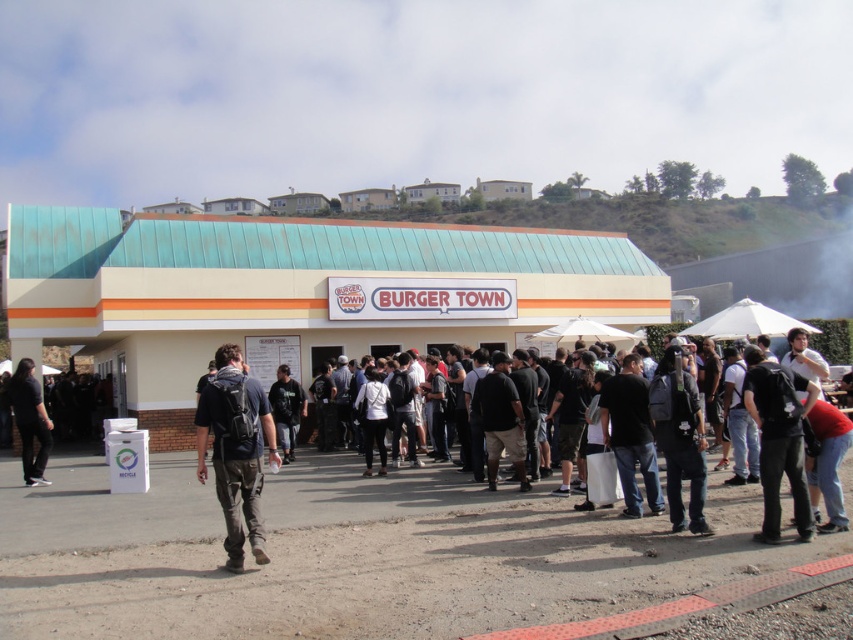
You are standing at the entrance of Burger Town and notice two people wearing dark blue jeans at center and dark gray fabric shirt at center. Which clothing item is located to the right when facing the entrance?

The dark blue jeans at center is positioned on the right side of dark gray fabric shirt at center, so it is located to the right when facing the entrance.

You are a photographer standing in front of the Burger Town restaurant. You notice two people in the crowd wearing dark blue jeans at center and dark gray fabric shirt at center. Which clothing item is positioned higher on their body?

The dark blue jeans at center is located above the dark gray fabric shirt at center, so the jeans are positioned higher on their body.

You are standing in front of the Burger Town restaurant and notice both the white matte building at center and the black matte shirt at center. Which object appears larger in the image?

The white matte building at center is bigger than the black matte shirt at center, so the building appears larger.